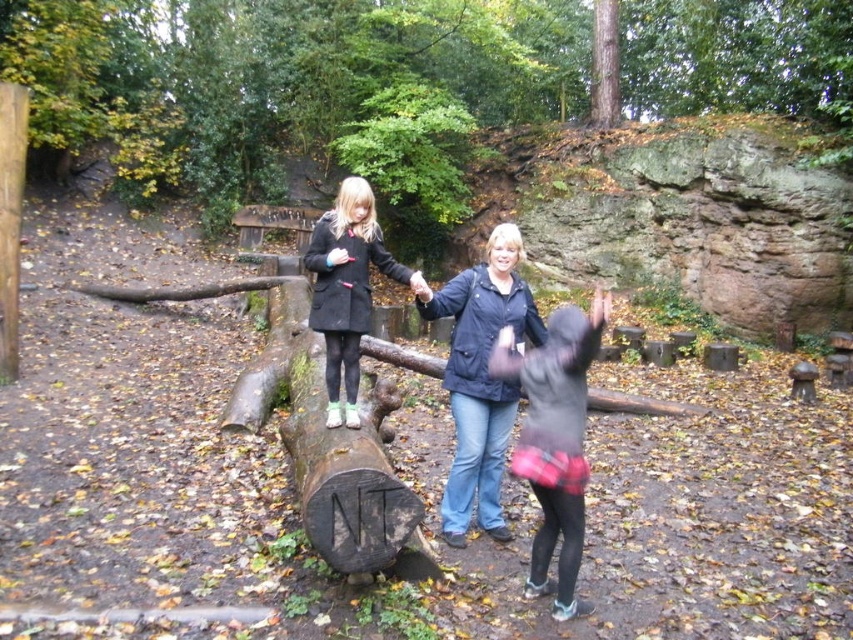
Question: Among these points, which one is nearest to the camera?

Choices:
 (A) click(596, 48)
 (B) click(556, 525)
 (C) click(469, 353)
 (D) click(376, 227)

Answer: (B)

Question: Which object is closer to the camera taking this photo?

Choices:
 (A) matte black coat at center
 (B) dark blue jacket at center

Answer: (B)

Question: Among these objects, which one is nearest to the camera?

Choices:
 (A) matte black coat at center
 (B) black fuzzy jacket at center
 (C) brown rough tree trunk at upper center
 (D) dark blue jacket at center

Answer: (B)

Question: Does matte black coat at center lie in front of brown rough tree trunk at upper center?

Choices:
 (A) yes
 (B) no

Answer: (A)

Question: Does black fuzzy jacket at center have a smaller size compared to brown rough tree trunk at upper center?

Choices:
 (A) no
 (B) yes

Answer: (B)

Question: Does matte black coat at center appear under brown rough tree trunk at upper center?

Choices:
 (A) yes
 (B) no

Answer: (A)